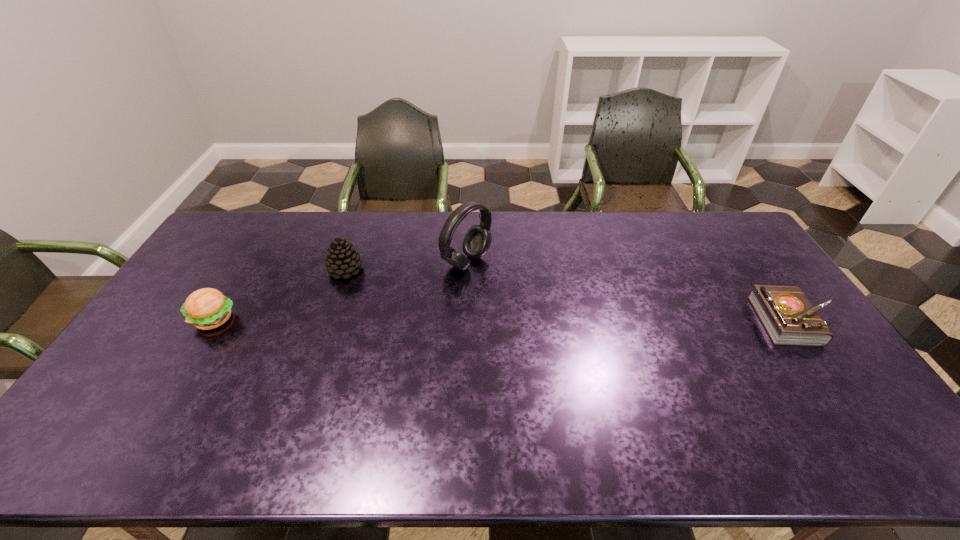
In the image, there is a desktop. Find the location of `vacant space at the near edge`. vacant space at the near edge is located at coordinates (x=230, y=414).

I want to click on vacant space at the left edge of the desktop, so click(x=194, y=332).

Find the location of a particular element. vacant space at the far left corner is located at coordinates (242, 215).

Image resolution: width=960 pixels, height=540 pixels. In order to click on free space at the far right corner of the desktop in this screenshot , I will do `click(710, 233)`.

This screenshot has width=960, height=540. Find the location of `vacant area that lies between the leftmost object and the rightmost object`. vacant area that lies between the leftmost object and the rightmost object is located at coordinates (503, 320).

Find the location of `vacant region between the rightmost object and the headset`. vacant region between the rightmost object and the headset is located at coordinates (630, 292).

The width and height of the screenshot is (960, 540). What are the coordinates of `vacant area between the shortest object and the third object from right to left` in the screenshot? It's located at (569, 295).

Where is `vacant area between the pinecone and the diary`? This screenshot has width=960, height=540. vacant area between the pinecone and the diary is located at coordinates (569, 295).

Where is `vacant area that lies between the pinecone and the leftmost object`? The height and width of the screenshot is (540, 960). vacant area that lies between the pinecone and the leftmost object is located at coordinates (279, 295).

Identify the location of free spot between the third tallest object and the second tallest object. (x=279, y=295).